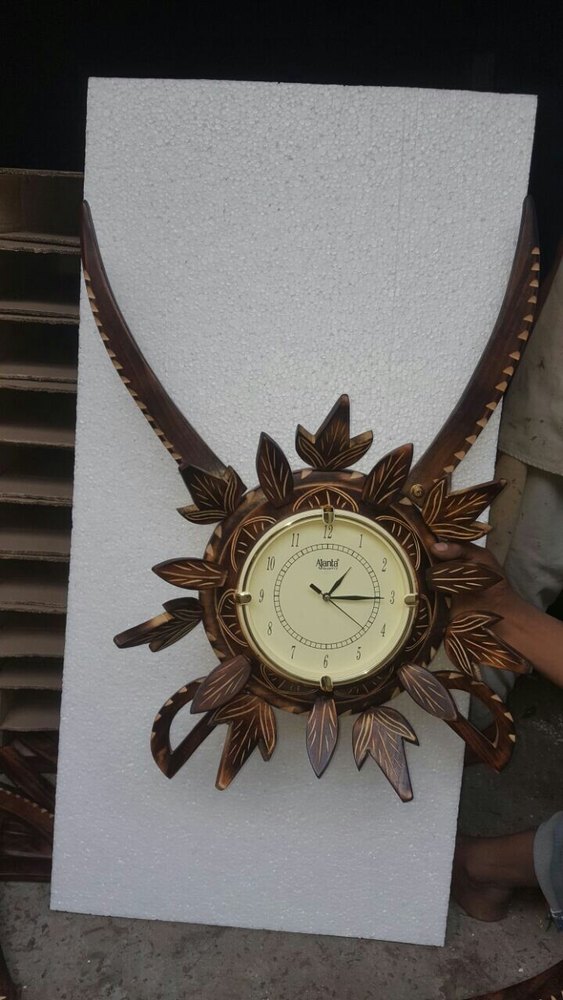
The image size is (563, 1000). I want to click on white chair, so click(516, 444).